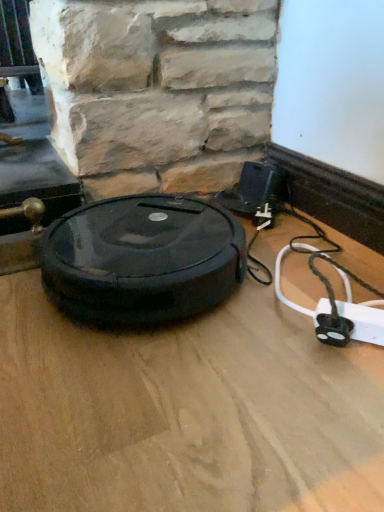
The width and height of the screenshot is (384, 512). Identify the location of free location in front of white plastic extension cord at lower right. (342, 426).